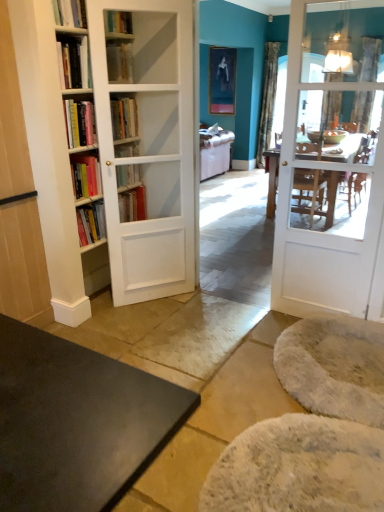
Image resolution: width=384 pixels, height=512 pixels. I want to click on unoccupied area behind gray fuzzy yoga mat at lower right, which appears as the 2th yoga mat when viewed from the back, so click(x=219, y=382).